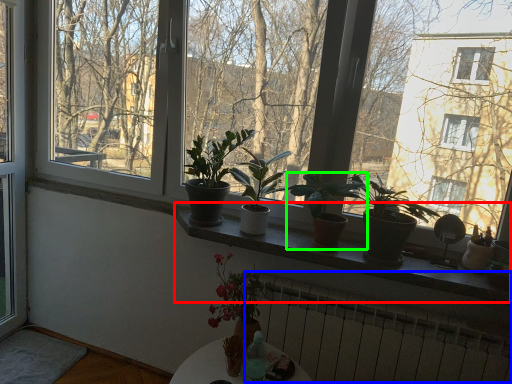
Question: Based on their relative distances, which object is nearer to window sill (highlighted by a red box)? Choose from radiator (highlighted by a blue box) and houseplant (highlighted by a green box).

Choices:
 (A) radiator
 (B) houseplant

Answer: (B)